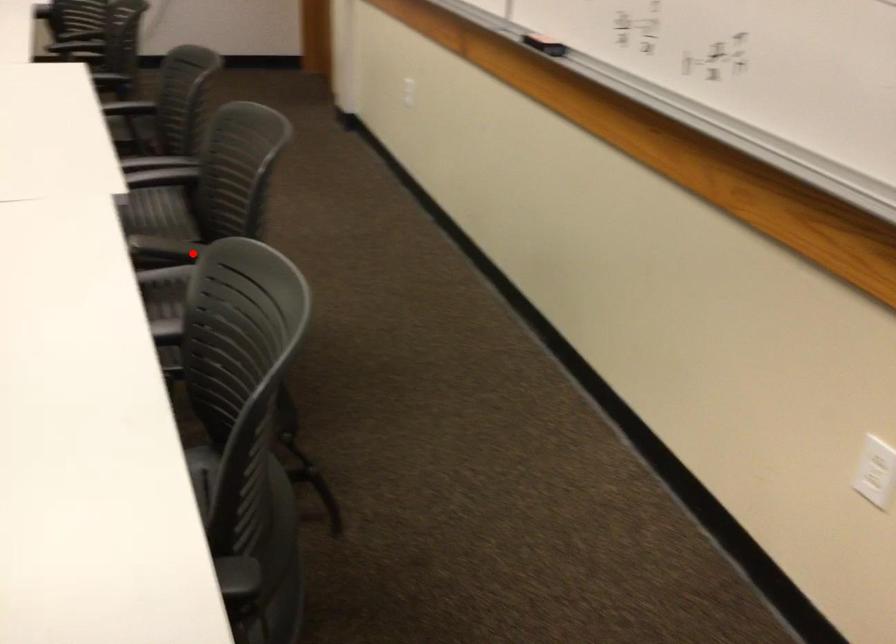
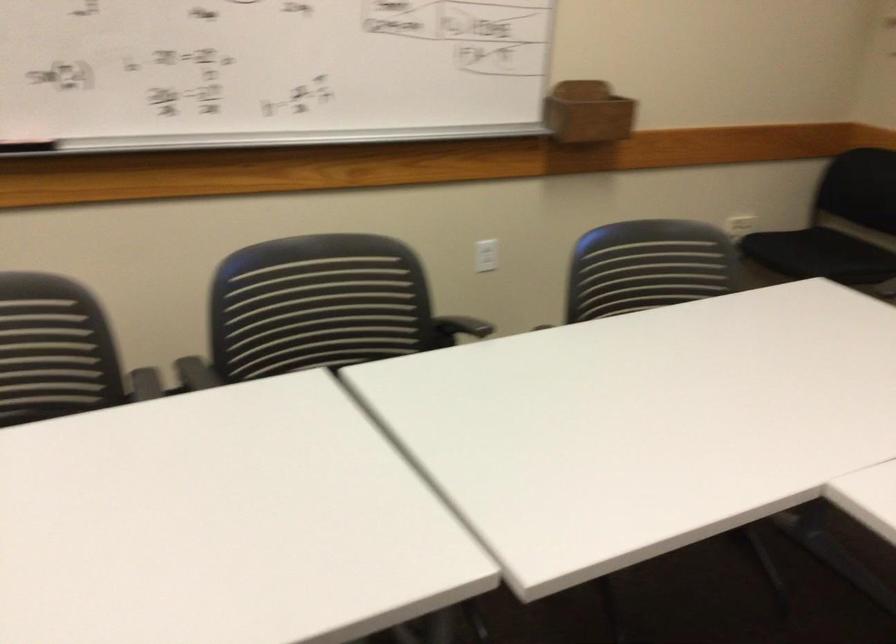
Question: I am providing you with two images of the same scene from different viewpoints. In image1, a red point is highlighted. Considering the same 3D point in image2, which of the following is correct?

Choices:
 (A) It is closer
 (B) It is farther

Answer: (B)